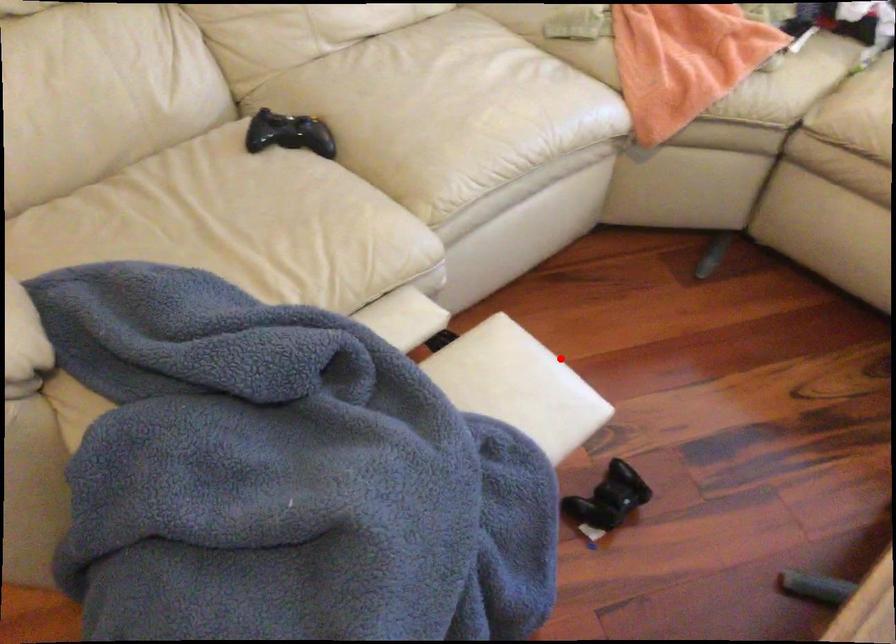
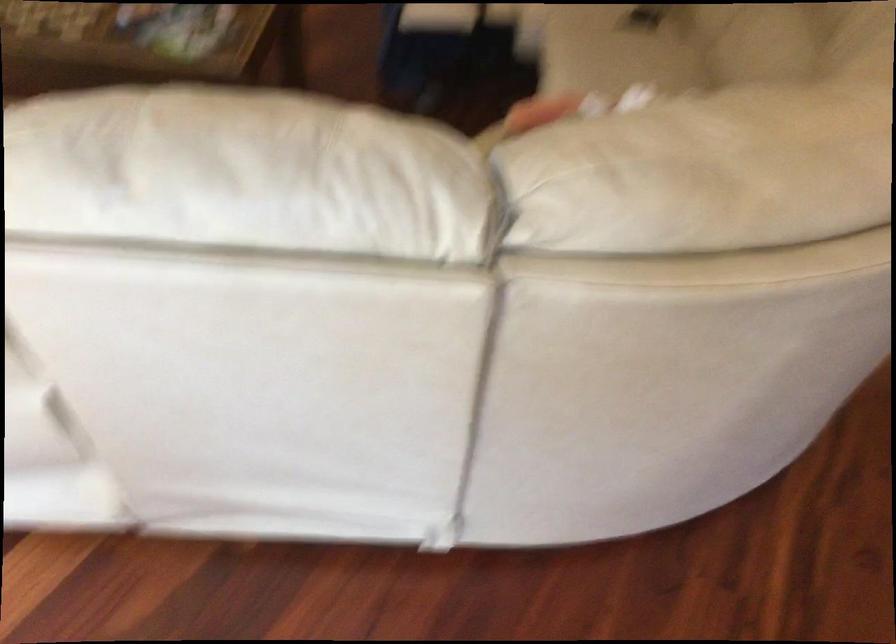
Question: I am providing you with two images of the same scene from different viewpoints. In image1, a red point is highlighted. Considering the same 3D point in image2, which of the following is correct?

Choices:
 (A) It is closer
 (B) It is farther

Answer: (B)